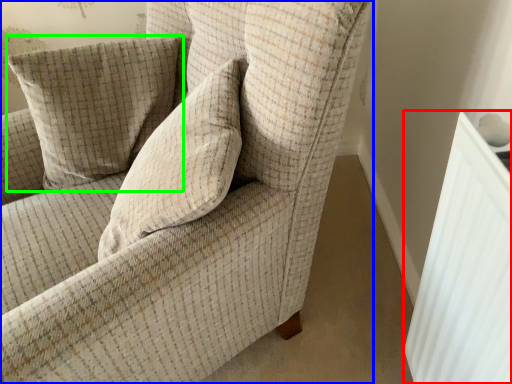
Question: Which is farther away from radiator (highlighted by a red box)? chair (highlighted by a blue box) or pillow (highlighted by a green box)?

Choices:
 (A) chair
 (B) pillow

Answer: (B)